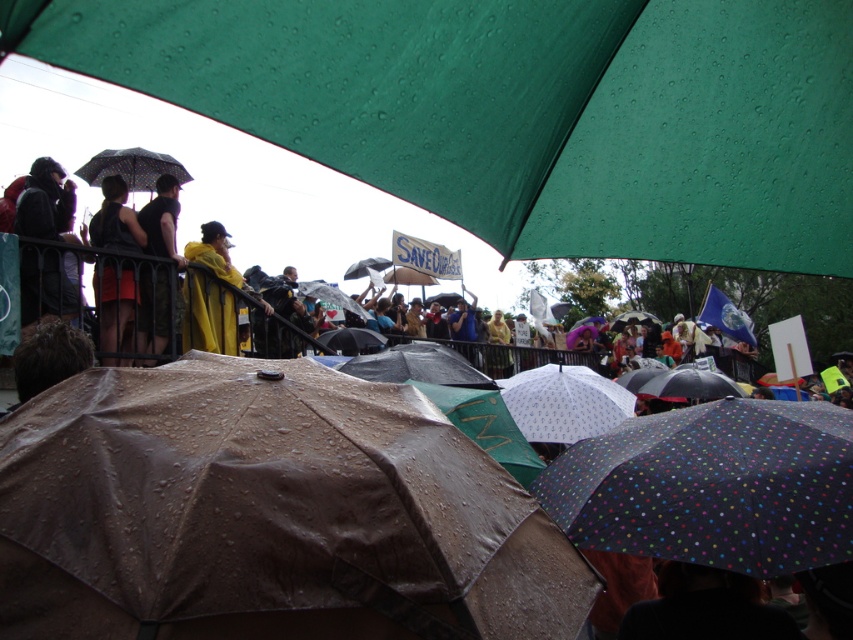
Between green matte umbrella at upper center and polka dot fabric umbrella at lower right, which one is positioned higher?

Positioned higher is green matte umbrella at upper center.

Is point (200, 49) farther from camera compared to point (647, 436)?

No, it is not.

What are the coordinates of `green matte umbrella at upper center` in the screenshot? It's located at (520, 109).

Which is in front, point (33, 276) or point (167, 212)?

Point (33, 276) is more forward.

Looking at this image, which of these two, dark gray jacket at left or dark brown leather jacket at upper left, stands shorter?

Standing shorter between the two is dark gray jacket at left.

Which is in front, point (51, 205) or point (173, 218)?

Positioned in front is point (51, 205).

The height and width of the screenshot is (640, 853). In order to click on dark gray jacket at left in this screenshot , I will do `click(44, 202)`.

Locate an element on the screen. The height and width of the screenshot is (640, 853). brown matte umbrella at center is located at coordinates (267, 513).

Is point (440, 532) farther from camera compared to point (158, 340)?

No, it is in front of (158, 340).

Does point (477, 595) lie behind point (163, 180)?

No.

Locate an element on the screen. The height and width of the screenshot is (640, 853). brown matte umbrella at center is located at coordinates pyautogui.click(x=267, y=513).